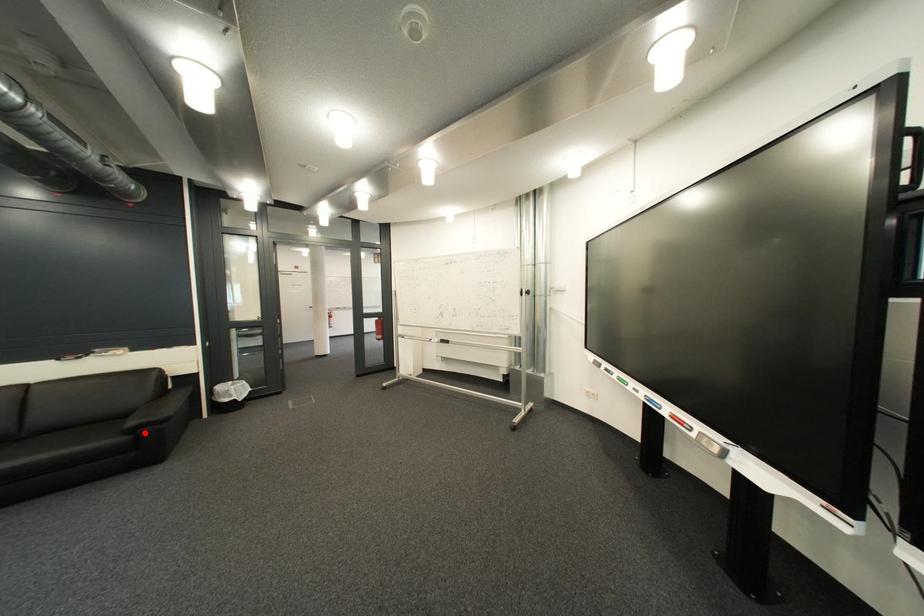
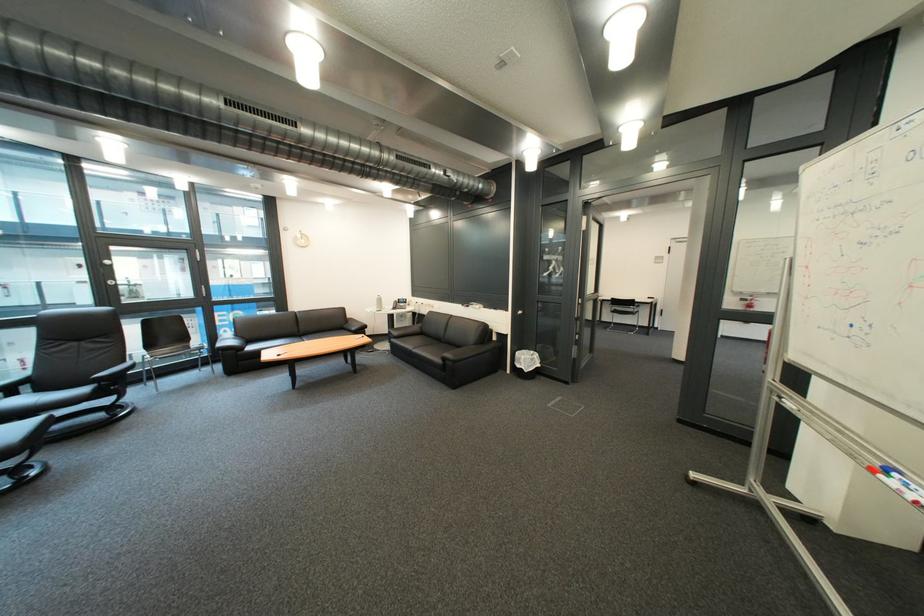
The point at the highlighted location is marked in the first image. Where is the corresponding point in the second image?

(457, 361)